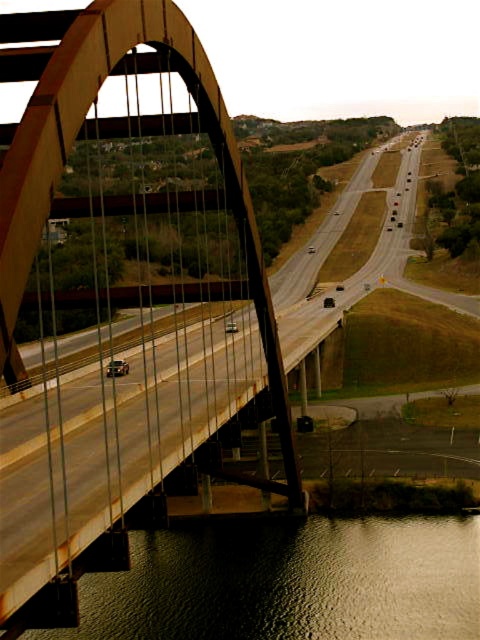
Question: In this image, where is rusty metal pedestrian bridge at center located relative to smooth brown water at lower center?

Choices:
 (A) left
 (B) right

Answer: (A)

Question: Which of the following is the closest to the observer?

Choices:
 (A) (468, 593)
 (B) (176, 371)

Answer: (A)

Question: Which point appears farthest from the camera in this image?

Choices:
 (A) (240, 544)
 (B) (112, 291)

Answer: (A)

Question: Which object is closer to the camera taking this photo?

Choices:
 (A) rusty metal pedestrian bridge at center
 (B) smooth brown water at lower center

Answer: (A)

Question: Is rusty metal pedestrian bridge at center smaller than smooth brown water at lower center?

Choices:
 (A) yes
 (B) no

Answer: (B)

Question: Observing the image, what is the correct spatial positioning of rusty metal pedestrian bridge at center in reference to smooth brown water at lower center?

Choices:
 (A) above
 (B) below

Answer: (A)